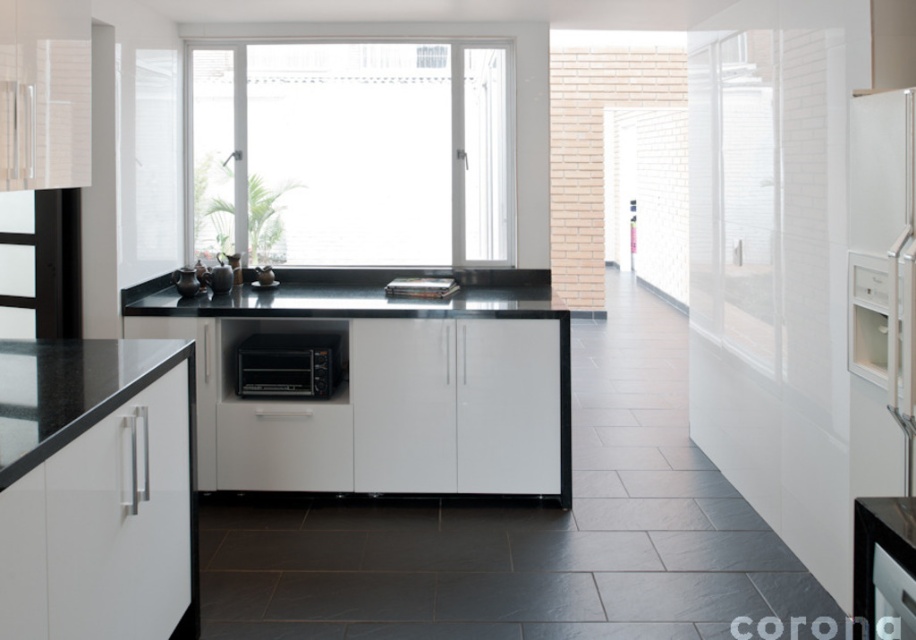
Question: Can you confirm if transparent glass door at right is wider than black granite countertop at center?

Choices:
 (A) no
 (B) yes

Answer: (A)

Question: Which object is positioned farthest from the black granite countertop at center?

Choices:
 (A) white glass window at center
 (B) black plastic toaster oven at center

Answer: (A)

Question: From the image, what is the correct spatial relationship of white glass window at center in relation to black granite countertop at center?

Choices:
 (A) above
 (B) below

Answer: (A)

Question: Where is white glass window at center located in relation to transparent glass door at right in the image?

Choices:
 (A) right
 (B) left

Answer: (B)

Question: Considering the real-world distances, which object is farthest from the white glass window at center?

Choices:
 (A) black plastic toaster oven at center
 (B) black granite countertop at lower left

Answer: (B)

Question: Estimate the real-world distances between objects in this image. Which object is farther from the black granite countertop at center?

Choices:
 (A) white glass window at center
 (B) black plastic toaster oven at center

Answer: (A)